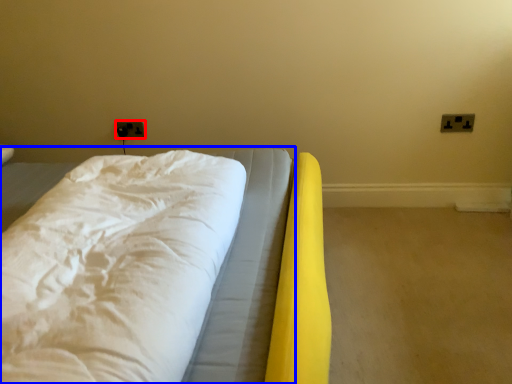
Question: Which of the following is the closest to the observer, electric outlet (highlighted by a red box) or bed (highlighted by a blue box)?

Choices:
 (A) electric outlet
 (B) bed

Answer: (B)